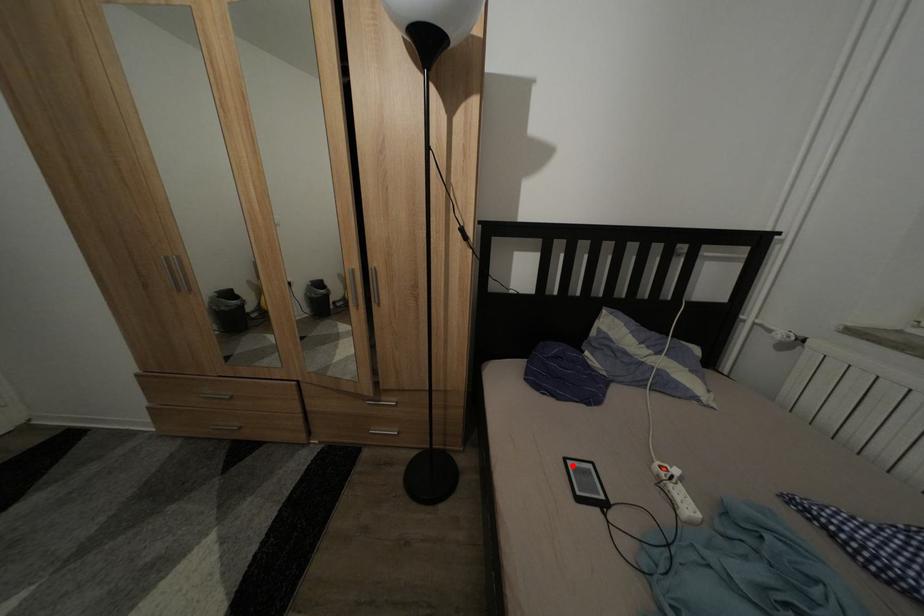
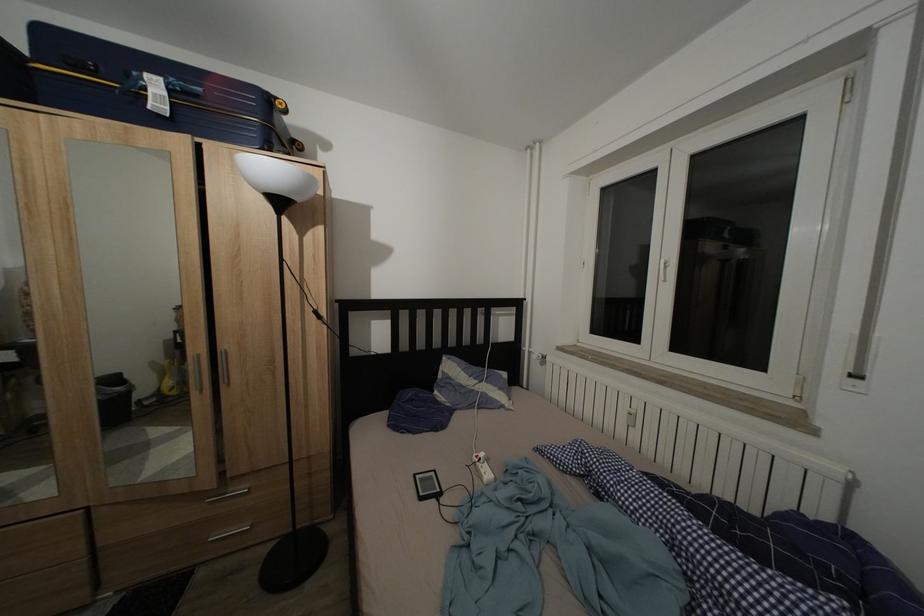
Locate, in the second image, the point that corresponds to the highlighted location in the first image.

(422, 482)